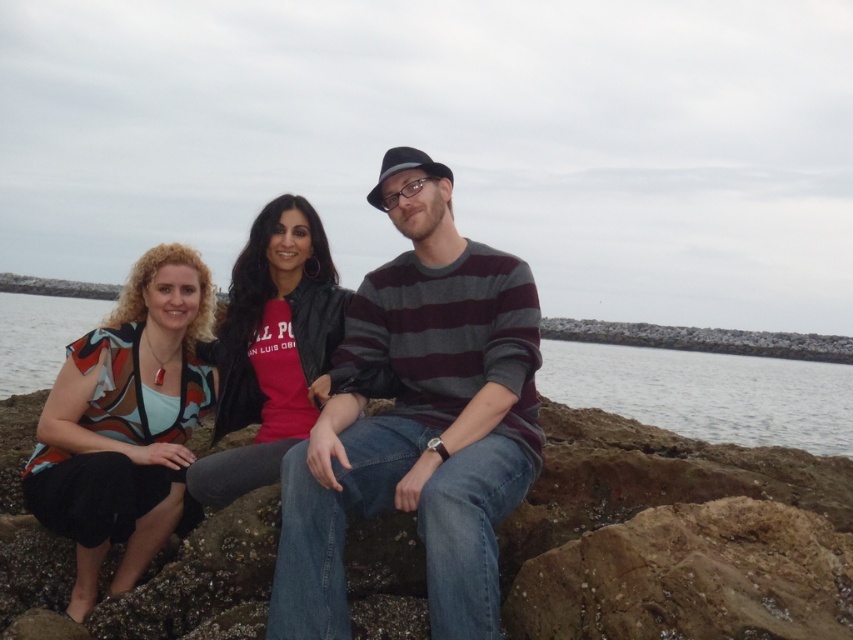
You are standing at the point with coordinates point (38, 365) and want to move to the point with coordinates point (413, 268). Which direction should you move to reach your destination?

You should move forward to reach point (413, 268) because it is in front of point (38, 365).

You are a photographer planning to take a portrait of the group. The clear water at center and the matte black jacket at center are in the background. Which object will appear larger in the photo?

The clear water at center will appear larger in the photo because it is much taller than the matte black jacket at center.

You are trying to decide which item to pack first in your bag. You have the matte multicolored blouse at left and the matte black jacket at center. Based on their sizes, which one should you pack first to optimize space?

The matte multicolored blouse at left occupies less space than the matte black jacket at center, so you should pack the matte black jacket at center first to optimize space.